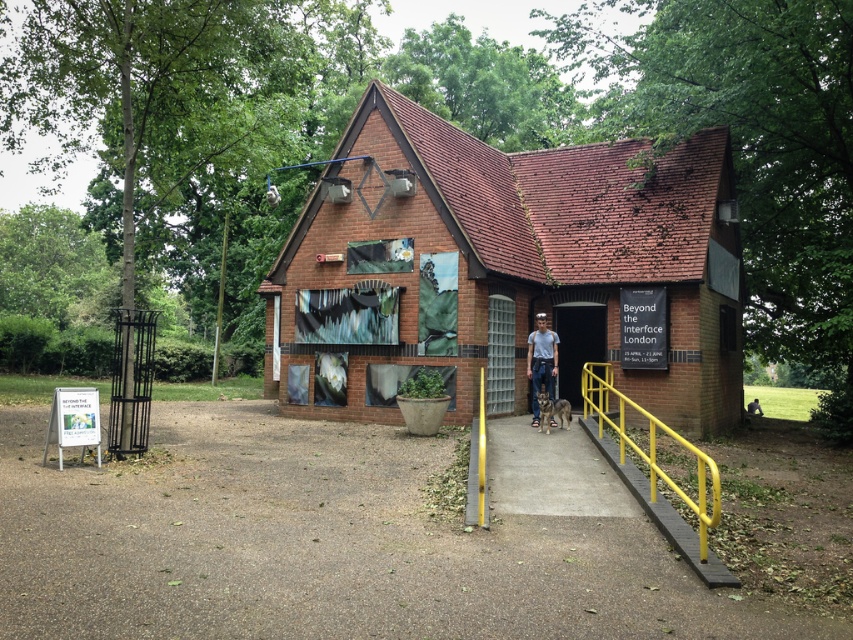
You are planning to paint the brick building at center and the matte glass door at center. If you have enough paint to cover 100 square meters, which object should you prioritize to ensure it gets fully painted?

The brick building at center is bigger than matte glass door at center, so you should prioritize painting the brick building at center to ensure it gets fully painted first before the paint runs out.

You are standing at the entrance of the brick building and want to locate the point at coordinates (503,268). Based on the scene description, where would this point be located?

The point at coordinates (503,268) is on the brick building at center, so it would be located on the central structure of the building.

You are standing in front of the brick building and want to determine which of the two points, point (556, 273) or point (593, 374), is closer to you. Which one would you say is nearer?

Point (556, 273) is closer to you because it is further to the viewer than point (593, 374).